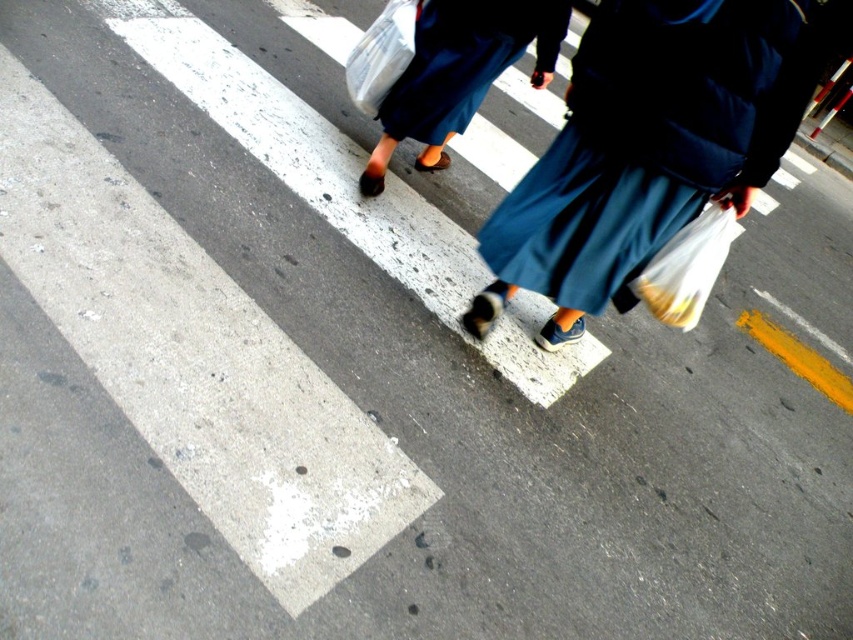
Question: Does translucent plastic bag at lower right come in front of translucent plastic bag at upper center?

Choices:
 (A) no
 (B) yes

Answer: (B)

Question: Does blue fabric skirt at center appear on the left side of translucent plastic bag at upper center?

Choices:
 (A) yes
 (B) no

Answer: (B)

Question: Among these points, which one is farthest from the camera?

Choices:
 (A) (727, 186)
 (B) (732, 208)

Answer: (B)

Question: Based on their relative distances, which object is farther from the translucent plastic bag at upper center?

Choices:
 (A) translucent plastic bag at lower right
 (B) blue fabric skirt at center

Answer: (A)

Question: Among these objects, which one is farthest from the camera?

Choices:
 (A) translucent plastic bag at upper center
 (B) blue fabric skirt at center

Answer: (A)

Question: Is translucent plastic bag at lower right thinner than translucent plastic bag at upper center?

Choices:
 (A) no
 (B) yes

Answer: (B)